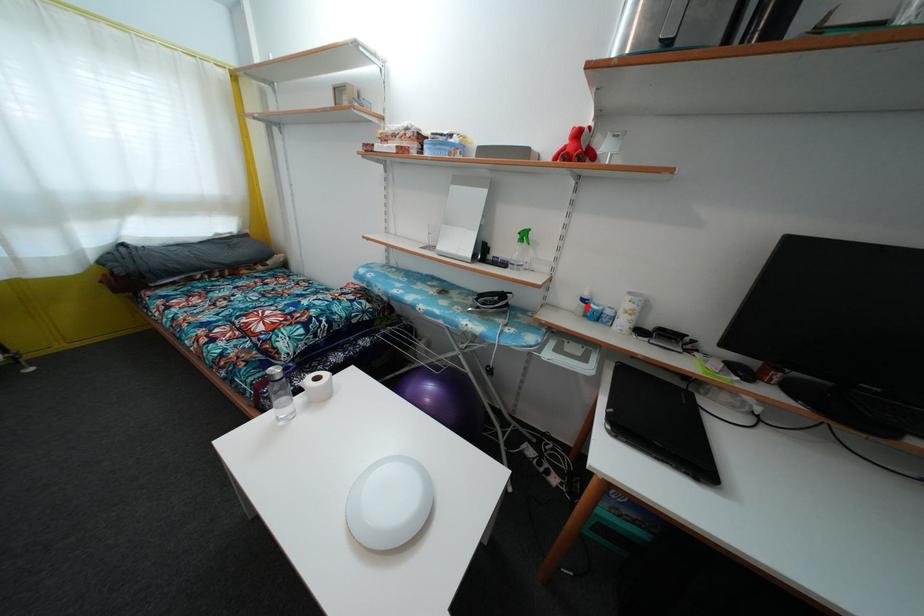
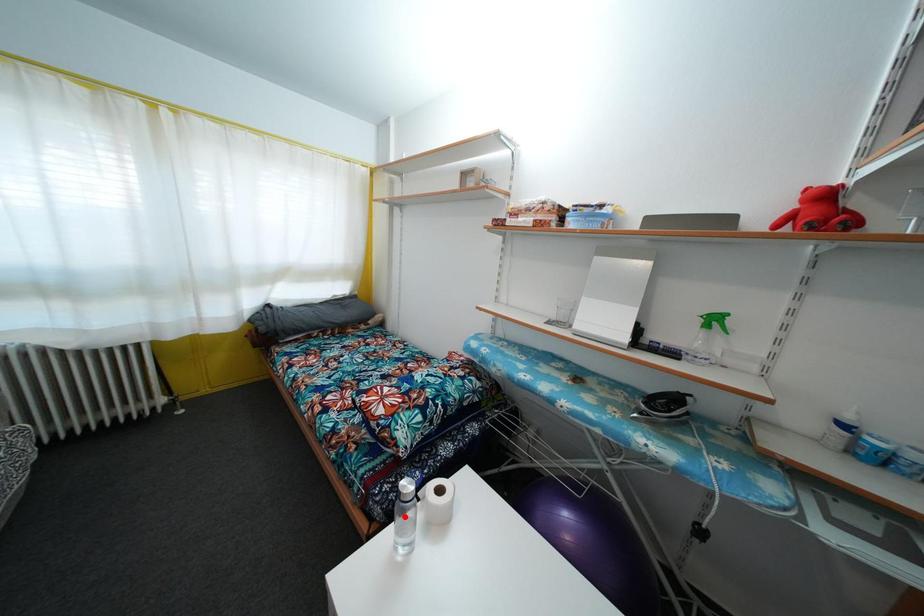
I am providing you with two images of the same scene from different viewpoints. A red point is marked on the first image and another point is marked on the second image. Are the points marked in image1 and image2 representing the same 3D position?

No